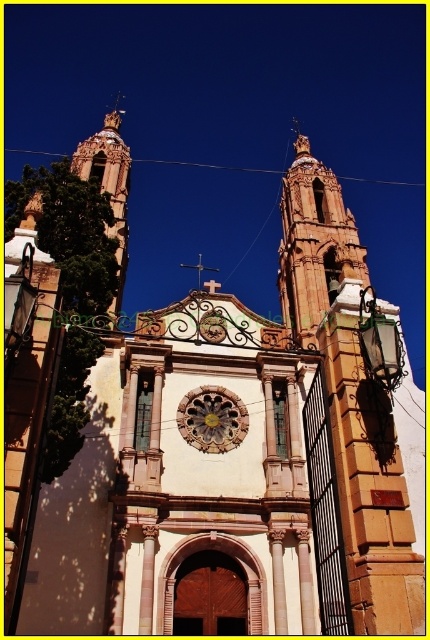
You are standing in front of the church and notice two clocks on its facade. The first is labeled as the golden stone clock at center, and the second is the gold metallic clock at center. Which clock appears closer to you?

The golden stone clock at center appears closer to you because it is positioned closer to the viewer than the gold metallic clock at center according to the description.